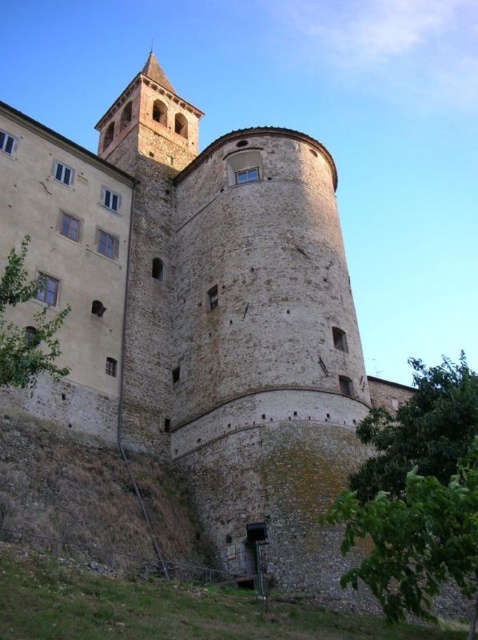
Question: Which point is closer to the camera?

Choices:
 (A) (416, 600)
 (B) (7, 376)

Answer: (A)

Question: Is the position of green leafy tree at lower right less distant than that of green leafy tree at lower left?

Choices:
 (A) yes
 (B) no

Answer: (A)

Question: Does green leafy tree at lower right appear on the right side of green leafy tree at lower left?

Choices:
 (A) yes
 (B) no

Answer: (A)

Question: Among these points, which one is farthest from the camera?

Choices:
 (A) (64, 314)
 (B) (408, 518)

Answer: (A)

Question: From the image, what is the correct spatial relationship of green leafy tree at lower right in relation to green leafy tree at lower left?

Choices:
 (A) left
 (B) right

Answer: (B)